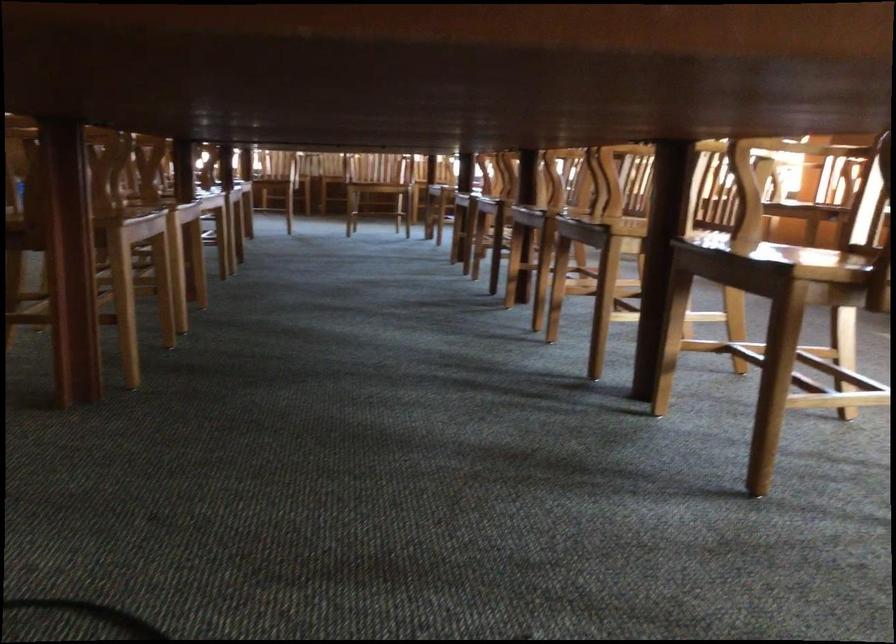
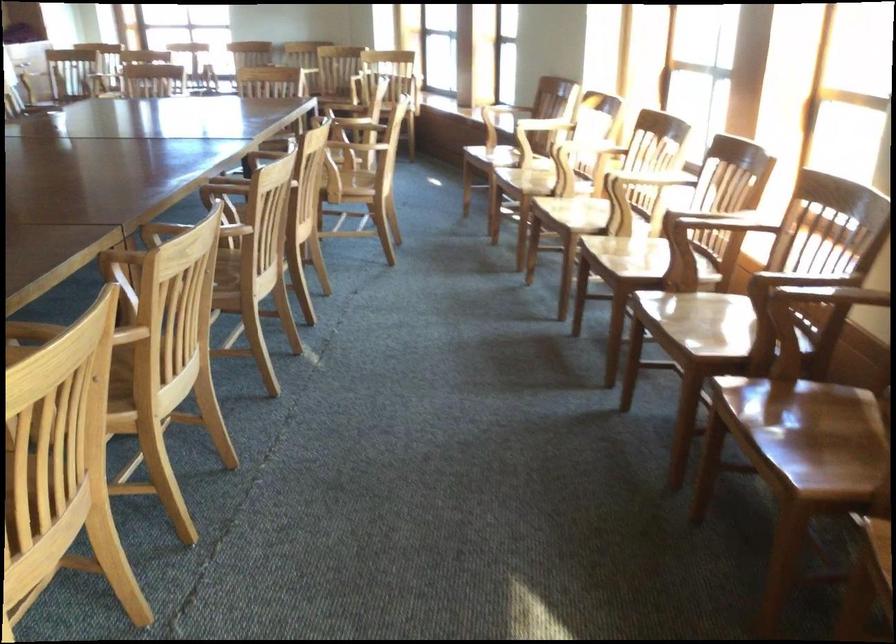
What movement of the cameraman would produce the second image?

The movement direction of the cameraman is right, forward.